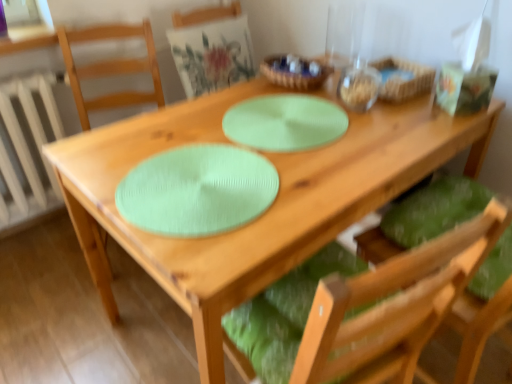
In order to click on free space to the left of wooden bowl at upper center in this screenshot , I will do `click(245, 91)`.